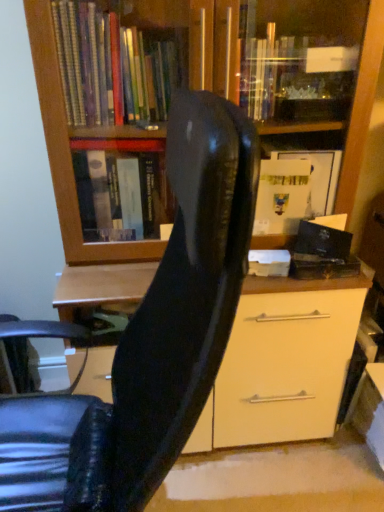
You are a GUI agent. You are given a task and a screenshot of the screen. Output one action in this format:
    pyautogui.click(x=<x>, y=<y>)
    Task: Click on the black matte book at right
    This screenshot has height=512, width=384.
    Given the screenshot: What is the action you would take?
    pyautogui.click(x=324, y=238)

Consider the image. In order to face glossy black chair at center, should I rotate leftwards or rightwards?

It's best to rotate left around 17.440 degrees.

What do you see at coordinates (282, 67) in the screenshot? This screenshot has width=384, height=512. I see `matte wood bookcase at upper center` at bounding box center [282, 67].

Where is `black matte book at right`? black matte book at right is located at coordinates (324, 238).

Does black matte book at right have a larger size compared to matte wood bookcase at upper center?

Incorrect, black matte book at right is not larger than matte wood bookcase at upper center.

How different are the orientations of black matte book at right and matte wood bookcase at upper center in degrees?

8.48 degrees separate the facing orientations of black matte book at right and matte wood bookcase at upper center.

Is black matte book at right oriented towards matte wood bookcase at upper center?

Yes, black matte book at right is aimed at matte wood bookcase at upper center.

Is matte wood bookcase at upper center completely or partially inside black matte book at right?

No.

Is glossy black chair at center positioned with its back to black matte book at right?

glossy black chair at center does not have its back to black matte book at right.

Locate an element on the screen. paperback book behind the glossy black chair at center is located at coordinates (324, 238).

From a real-world perspective, is glossy black chair at center located higher than black matte book at right?

No, from a real-world perspective, glossy black chair at center is not over black matte book at right

Which point is more distant from viewer, [221,222] or [300,232]?

The point [300,232] is behind.

Considering the relative positions of matte wood bookcase at upper center and glossy black chair at center in the image provided, is matte wood bookcase at upper center in front of glossy black chair at center?

That is False.

In the scene shown: Is matte wood bookcase at upper center directly adjacent to glossy black chair at center?

They are not placed beside each other.

Is point (82, 255) behind point (255, 183)?

Yes.

This screenshot has height=512, width=384. In order to click on chair in front of the black matte book at right in this screenshot , I will do `click(150, 337)`.

From a real-world perspective, which is physically above, black matte book at right or glossy black chair at center?

black matte book at right, from a real-world perspective.

Which object is more forward, black matte book at right or glossy black chair at center?

glossy black chair at center is closer to the camera.

Is black matte book at right far away from glossy black chair at center?

No.

Based on the photo, is matte wood bookcase at upper center not near black matte book at right?

matte wood bookcase at upper center is near black matte book at right, not far away.

Which object is positioned more to the right, matte wood bookcase at upper center or black matte book at right?

Positioned to the right is black matte book at right.

Is point (50, 61) positioned behind point (329, 245)?

No.

Based on the photo, from the image's perspective, is matte wood bookcase at upper center on top of black matte book at right?

No, from the image's perspective, matte wood bookcase at upper center is not on top of black matte book at right.

Is glossy black chair at center at the left side of matte wood bookcase at upper center?

Yes.

Is glossy black chair at center wider or thinner than matte wood bookcase at upper center?

In the image, glossy black chair at center appears to be wider than matte wood bookcase at upper center.

Is glossy black chair at center inside the boundaries of matte wood bookcase at upper center, or outside?

glossy black chair at center cannot be found inside matte wood bookcase at upper center.

Where is `bookcase on the left of black matte book at right`? The height and width of the screenshot is (512, 384). bookcase on the left of black matte book at right is located at coordinates (282, 67).

This screenshot has width=384, height=512. There is a glossy black chair at center. In order to click on paperback book above it (from a real-world perspective) in this screenshot , I will do pos(324,238).

Based on their spatial positions, is glossy black chair at center or matte wood bookcase at upper center further from black matte book at right?

glossy black chair at center is positioned further to the anchor black matte book at right.

Based on their spatial positions, is black matte book at right or glossy black chair at center closer to matte wood bookcase at upper center?

black matte book at right is closer to matte wood bookcase at upper center.

When comparing their distances from matte wood bookcase at upper center, does glossy black chair at center or black matte book at right seem further?

glossy black chair at center.

Based on their spatial positions, is matte wood bookcase at upper center or glossy black chair at center closer to black matte book at right?

matte wood bookcase at upper center lies closer to black matte book at right than the other object.

Looking at the image, which one is located further to glossy black chair at center, matte wood bookcase at upper center or black matte book at right?

Based on the image, black matte book at right appears to be further to glossy black chair at center.

Looking at the image, which one is located closer to glossy black chair at center, black matte book at right or matte wood bookcase at upper center?

matte wood bookcase at upper center is positioned closer to the anchor glossy black chair at center.

The height and width of the screenshot is (512, 384). I want to click on bookcase between glossy black chair at center and black matte book at right along the z-axis, so click(282, 67).